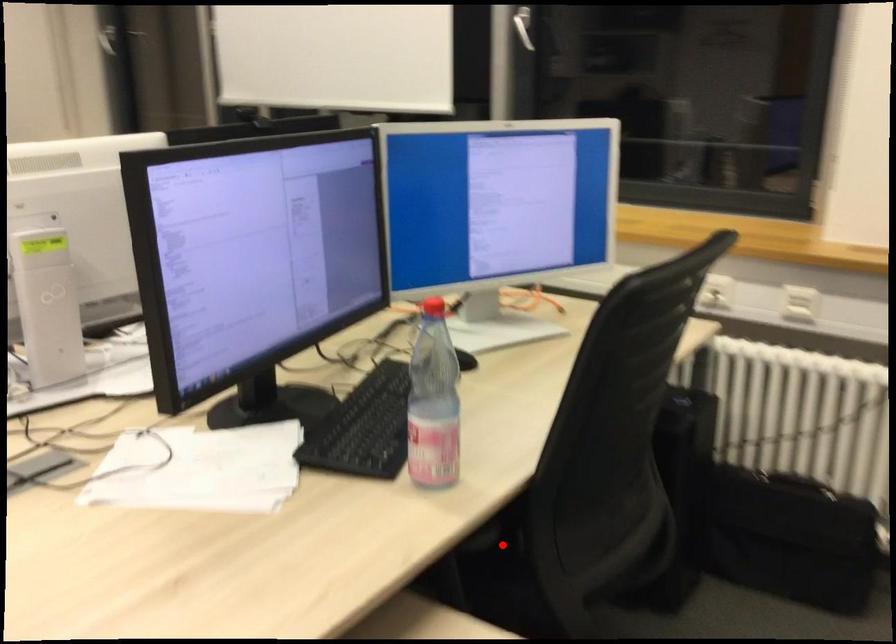
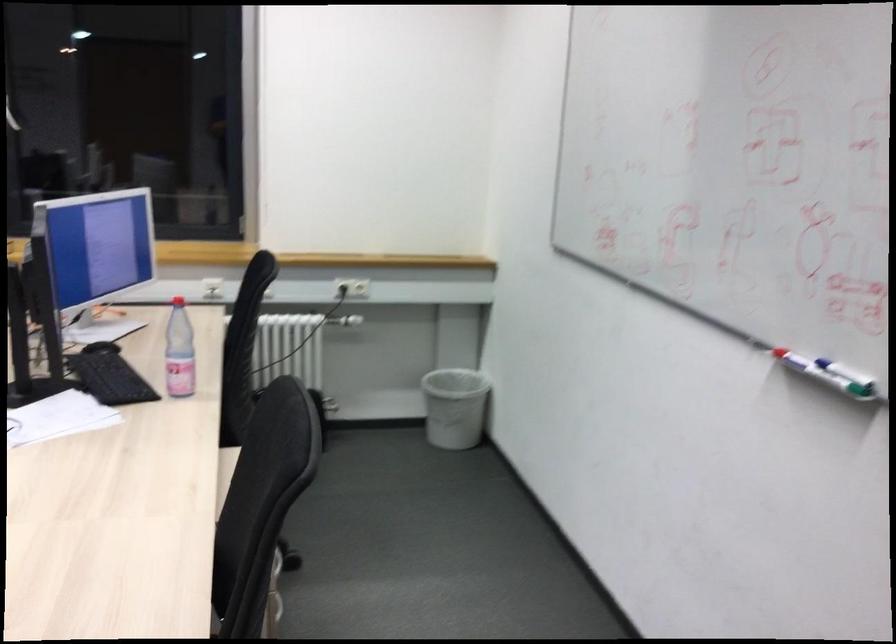
Question: I am providing you with two images of the same scene from different viewpoints. A red point is marked on the first image. At the location where the point appears in image 1, is it still visible in image 2?

Choices:
 (A) Yes
 (B) No

Answer: (B)